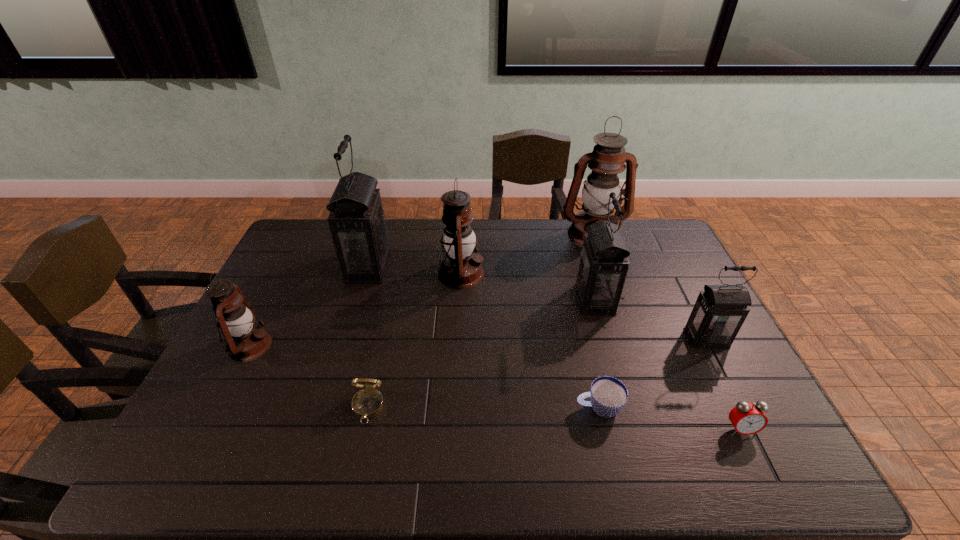
You are a GUI agent. You are given a task and a screenshot of the screen. Output one action in this format:
    pyautogui.click(x=<x>, y=<y>)
    Task: Click on the rightmost brown lantern
    The image size is (960, 540).
    Given the screenshot: What is the action you would take?
    coord(609,155)

I want to click on the farthest brown lantern, so click(609, 155).

Where is `the second lantern from left to right`? This screenshot has width=960, height=540. the second lantern from left to right is located at coordinates (357, 223).

Find the location of a particular element. the leftmost gray lantern is located at coordinates (357, 223).

The height and width of the screenshot is (540, 960). I want to click on the second brown lantern from left to right, so click(x=461, y=268).

I want to click on the sixth object from right to left, so click(461, 268).

Find the location of a particular element. The width and height of the screenshot is (960, 540). the second gray lantern from right to left is located at coordinates (603, 265).

Image resolution: width=960 pixels, height=540 pixels. What are the coordinates of `the rightmost gray lantern` in the screenshot? It's located at (720, 310).

At what (x,y) coordinates should I click in order to perform the action: click on the rightmost lantern. Please return your answer as a coordinate pair (x, y). This screenshot has width=960, height=540. Looking at the image, I should click on (720, 310).

You are a GUI agent. You are given a task and a screenshot of the screen. Output one action in this format:
    pyautogui.click(x=<x>, y=<y>)
    Task: Click on the leftmost lantern
    This screenshot has height=540, width=960.
    Given the screenshot: What is the action you would take?
    pyautogui.click(x=246, y=341)